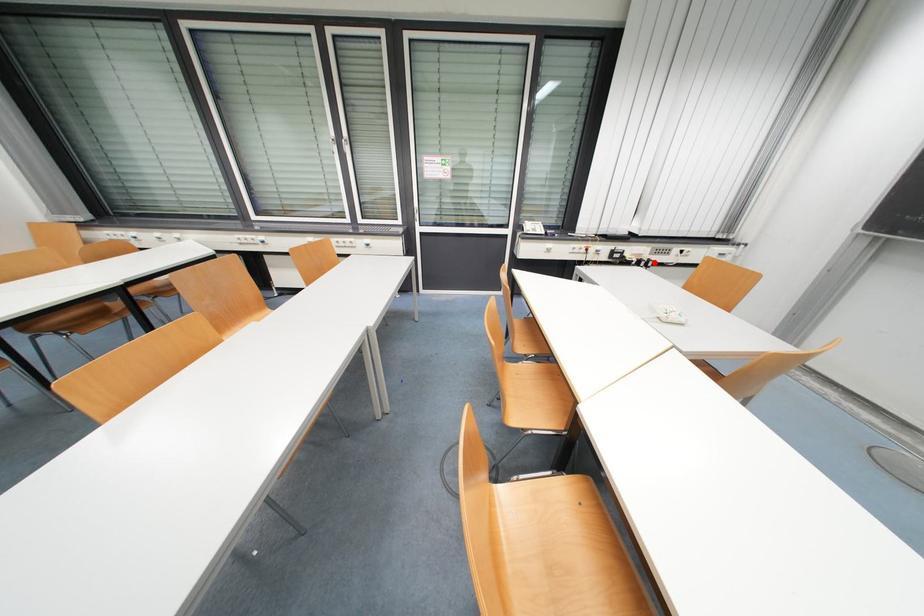
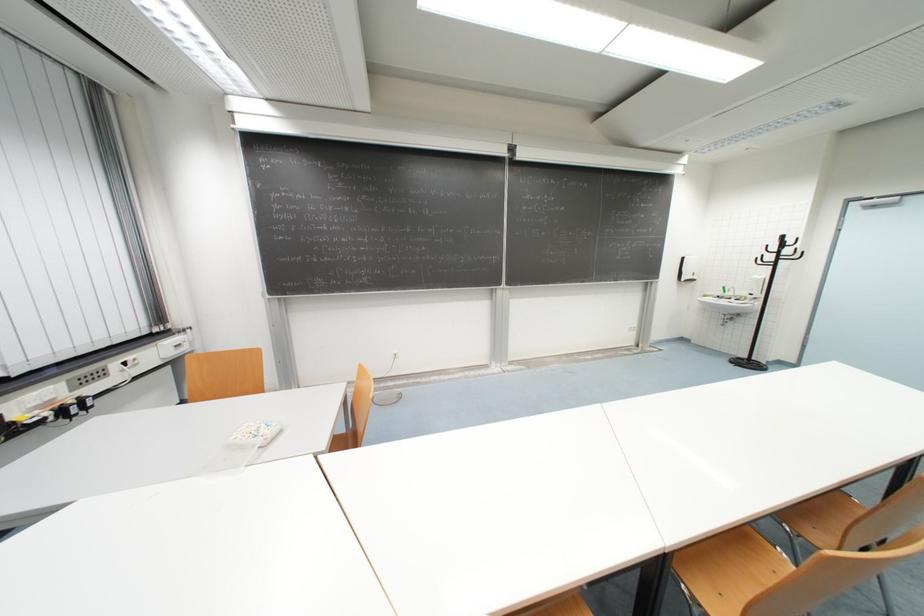
Question: I am providing you with two images of the same scene from different viewpoints. Image1 has a red point marked. In image2, the corresponding 3D location appears at what relative position? Reply with the corresponding letter.

Choices:
 (A) Closer
 (B) Farther

Answer: (B)